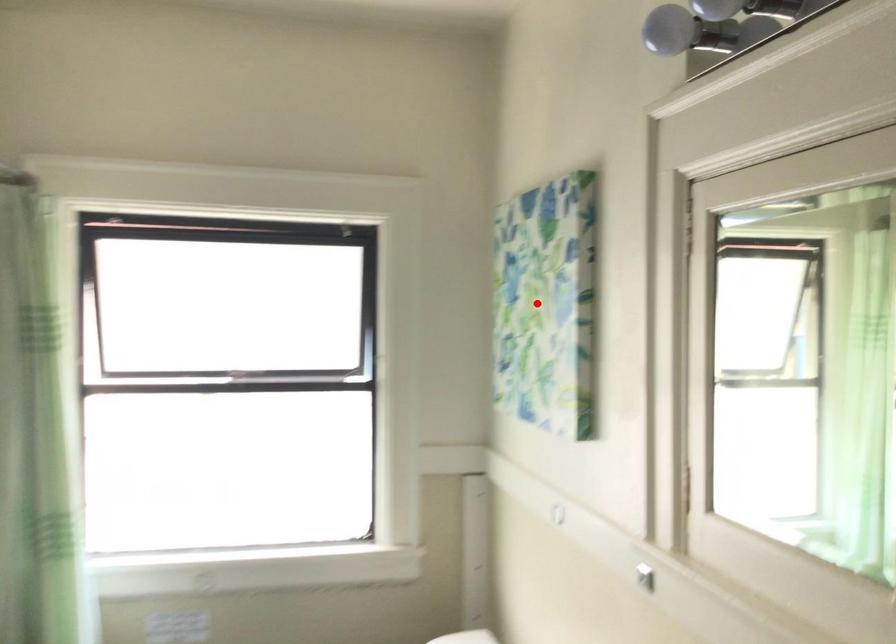
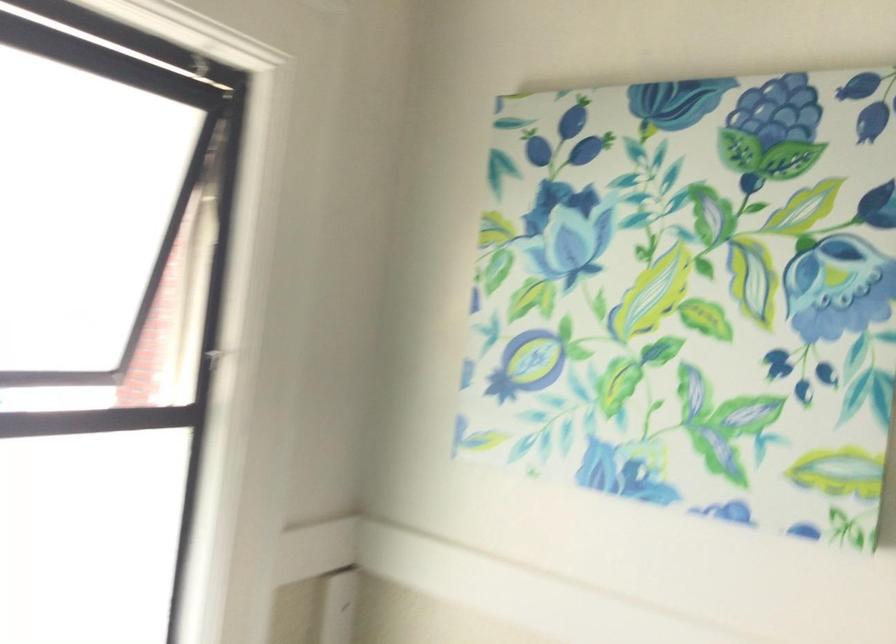
Question: I am providing you with two images of the same scene from different viewpoints. Image1 has a red point marked. In image2, the corresponding 3D location appears at what relative position? Reply with the corresponding letter.

Choices:
 (A) Closer
 (B) Farther

Answer: (A)